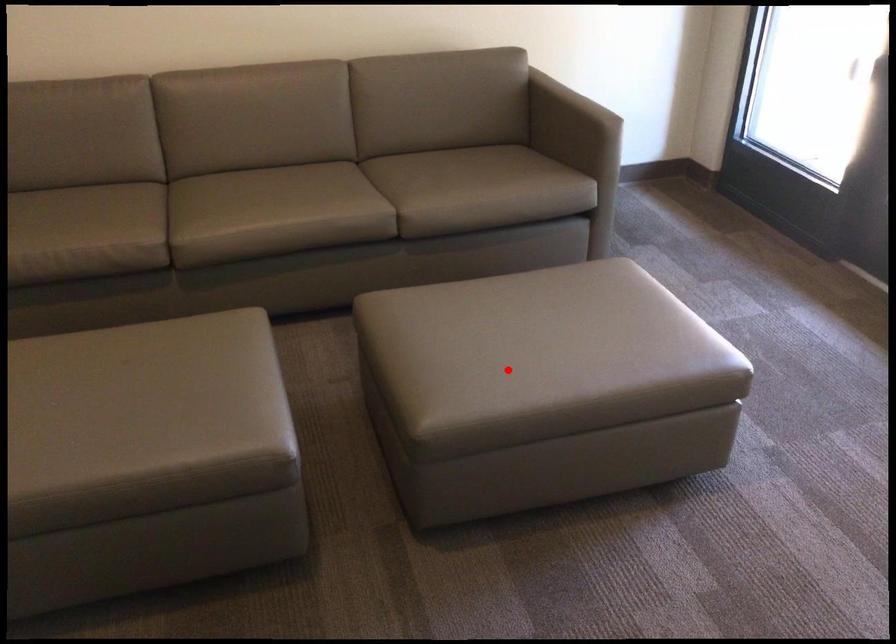
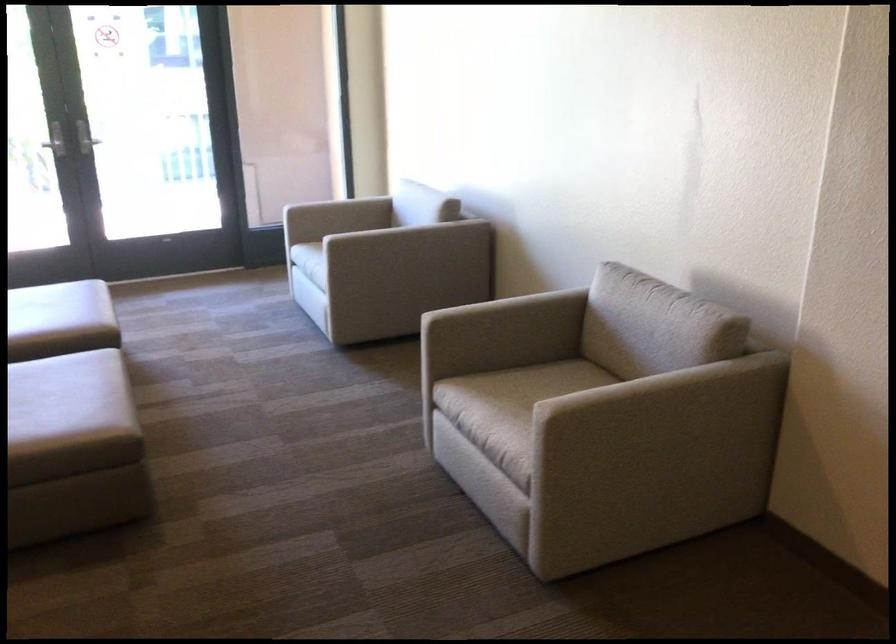
Question: I am providing you with two images of the same scene from different viewpoints. A red point is shown in image1. For the corresponding object point in image2, is it positioned nearer or farther from the camera?

Choices:
 (A) Nearer
 (B) Farther

Answer: (B)